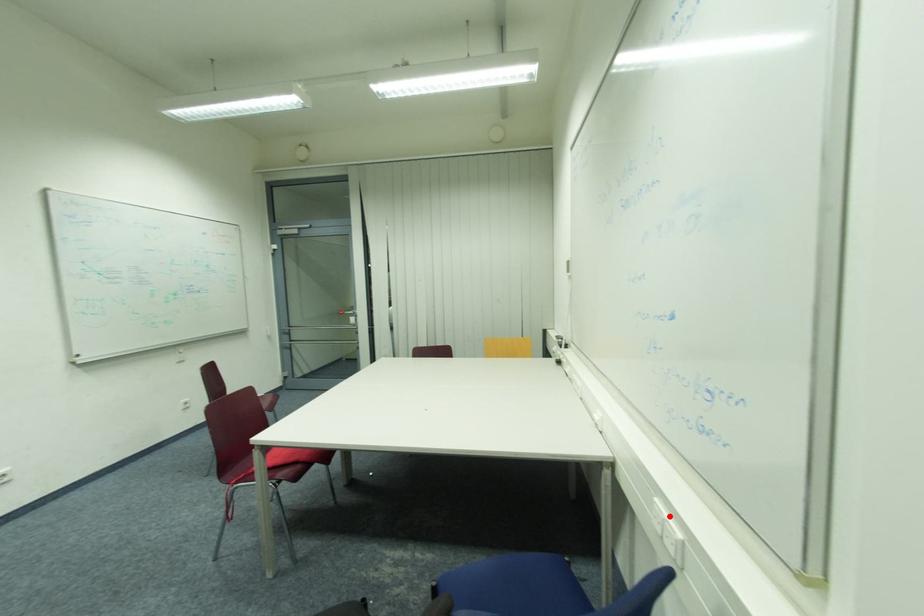
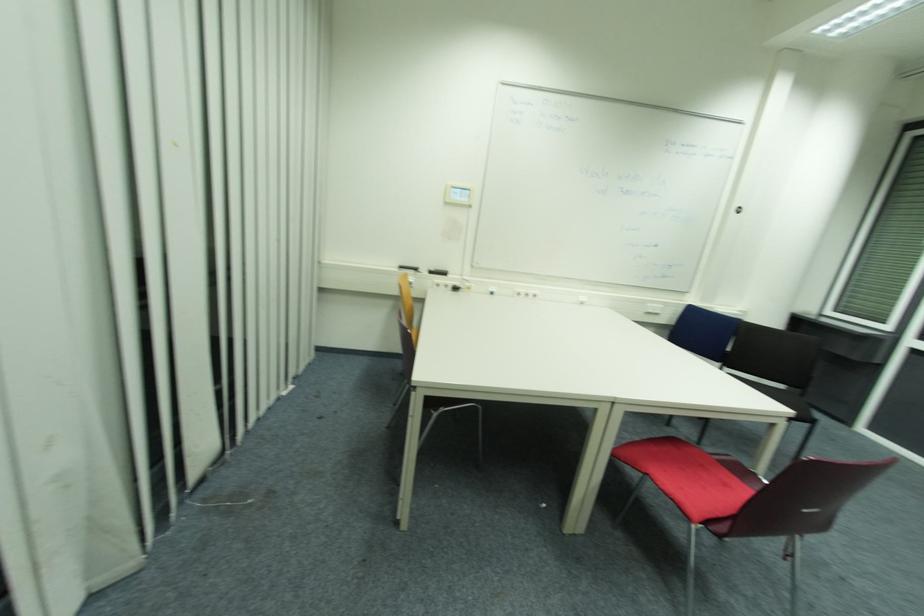
In the second image, find the point that corresponds to the highlighted location in the first image.

(658, 306)